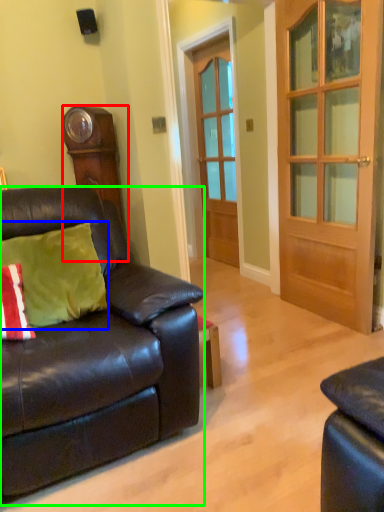
Question: Estimate the real-world distances between objects in this image. Which object is closer to cabinetry (highlighted by a red box), pillow (highlighted by a blue box) or studio couch (highlighted by a green box)?

Choices:
 (A) pillow
 (B) studio couch

Answer: (A)